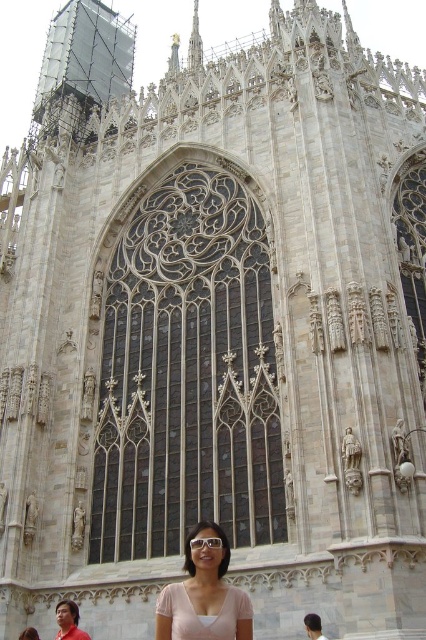
Identify the location of transparent plastic goggles at center. (204, 541).

Is transparent plastic goggles at center closer to camera compared to matte pink blouse at lower center?

That is True.

The image size is (426, 640). Describe the element at coordinates (204, 541) in the screenshot. I see `transparent plastic goggles at center` at that location.

Identify the location of transparent plastic goggles at center. This screenshot has width=426, height=640. (204, 541).

At what (x,y) coordinates should I click in order to perform the action: click on dark stained glass at center. Please return your answer as a coordinate pair (x, y). Looking at the image, I should click on (187, 376).

Which is in front, point (132, 358) or point (198, 547)?

Point (198, 547)

Does point (164, 362) come behind point (198, 548)?

Yes, it is.

I want to click on dark stained glass at center, so click(x=187, y=376).

This screenshot has width=426, height=640. In order to click on dark stained glass at center in this screenshot , I will do `click(187, 376)`.

What do you see at coordinates (187, 376) in the screenshot? I see `dark stained glass at center` at bounding box center [187, 376].

The width and height of the screenshot is (426, 640). What are the coordinates of `dark stained glass at center` in the screenshot? It's located at pos(187,376).